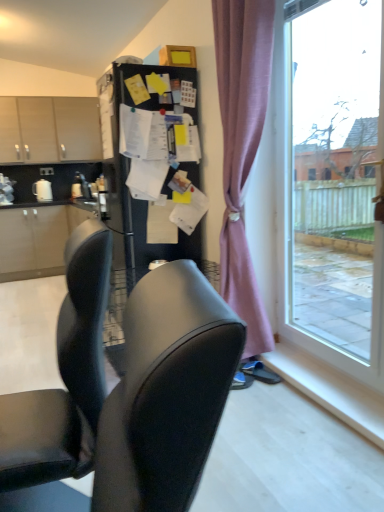
Question: Considering the relative positions of black matte refrigerator at center and blue suede shoes at lower right in the image provided, is black matte refrigerator at center to the left of blue suede shoes at lower right from the viewer's perspective?

Choices:
 (A) yes
 (B) no

Answer: (A)

Question: Does black matte refrigerator at center have a larger size compared to blue suede shoes at lower right?

Choices:
 (A) yes
 (B) no

Answer: (A)

Question: From a real-world perspective, is black matte refrigerator at center located beneath blue suede shoes at lower right?

Choices:
 (A) yes
 (B) no

Answer: (B)

Question: Could you tell me if black matte refrigerator at center is turned towards blue suede shoes at lower right?

Choices:
 (A) yes
 (B) no

Answer: (B)

Question: Is black matte refrigerator at center smaller than blue suede shoes at lower right?

Choices:
 (A) no
 (B) yes

Answer: (A)

Question: From a real-world perspective, is black matte refrigerator at center physically above blue suede shoes at lower right?

Choices:
 (A) yes
 (B) no

Answer: (A)

Question: Is the position of black matte refrigerator at center more distant than that of white glossy paper towel dispenser at left?

Choices:
 (A) no
 (B) yes

Answer: (A)

Question: Does black matte refrigerator at center contain white glossy paper towel dispenser at left?

Choices:
 (A) yes
 (B) no

Answer: (B)

Question: Would you consider black matte refrigerator at center to be distant from white glossy paper towel dispenser at left?

Choices:
 (A) yes
 (B) no

Answer: (A)

Question: Is black matte refrigerator at center bigger than white glossy paper towel dispenser at left?

Choices:
 (A) no
 (B) yes

Answer: (B)

Question: Are black matte refrigerator at center and white glossy paper towel dispenser at left beside each other?

Choices:
 (A) yes
 (B) no

Answer: (B)

Question: Does black matte refrigerator at center have a lesser height compared to white glossy paper towel dispenser at left?

Choices:
 (A) yes
 (B) no

Answer: (B)

Question: From a real-world perspective, is pink fabric curtain at right positioned under white glossy paper towel dispenser at left based on gravity?

Choices:
 (A) yes
 (B) no

Answer: (B)